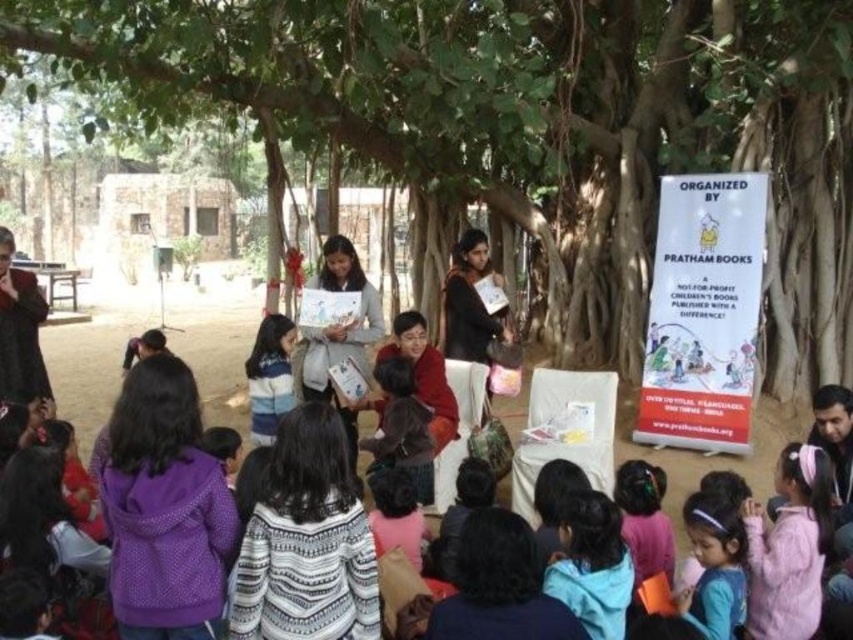
Question: Observing the image, what is the correct spatial positioning of green leafy tree at center in reference to pink fuzzy jacket at lower right?

Choices:
 (A) left
 (B) right

Answer: (A)

Question: Which point is farther to the camera?

Choices:
 (A) purple fleece jacket at lower left
 (B) striped sweater at center
 (C) pink fuzzy jacket at lower right
 (D) green leafy tree at center

Answer: (B)

Question: Can you confirm if purple fleece jacket at lower left is positioned above pink fuzzy jacket at lower right?

Choices:
 (A) yes
 (B) no

Answer: (A)

Question: Is green leafy tree at center closer to the viewer compared to pink fuzzy jacket at lower right?

Choices:
 (A) yes
 (B) no

Answer: (B)

Question: Which point is farther to the camera?

Choices:
 (A) green leafy tree at center
 (B) purple fleece jacket at lower left
 (C) pink fuzzy jacket at lower right

Answer: (A)

Question: Which of the following is the closest to the observer?

Choices:
 (A) green leafy tree at center
 (B) purple fleece jacket at lower left
 (C) striped sweater at center
 (D) pink fuzzy jacket at lower right

Answer: (B)